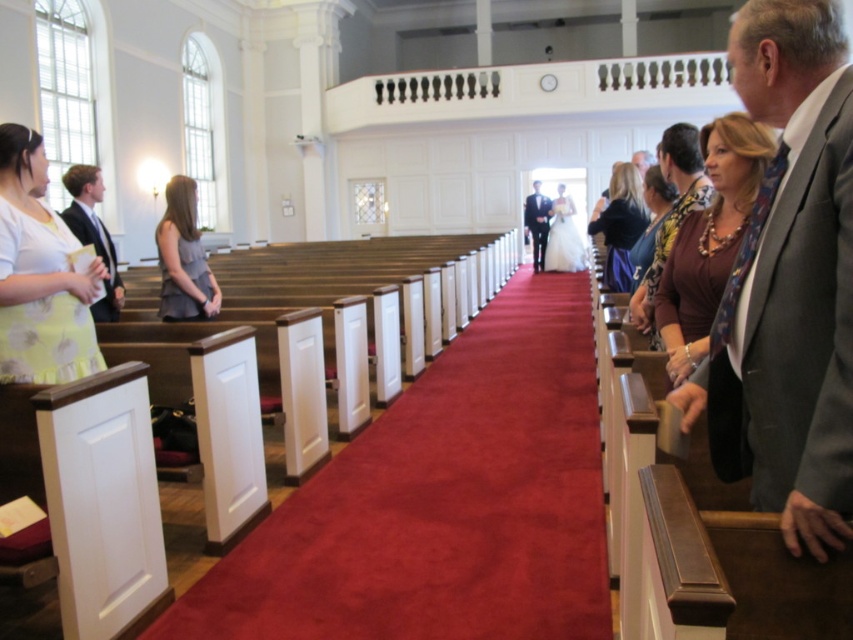
What do you see at coordinates (709, 240) in the screenshot? I see `brown fabric scarf at upper right` at bounding box center [709, 240].

Find the location of a particular element. This screenshot has width=853, height=640. brown fabric scarf at upper right is located at coordinates (709, 240).

Is point (688, 241) positioned before point (689, 140)?

Yes, it is.

At what (x,y) coordinates should I click in order to perform the action: click on brown fabric scarf at upper right. Please return your answer as a coordinate pair (x, y). This screenshot has width=853, height=640. Looking at the image, I should click on (709, 240).

Is yellow floral dress at left above brown fabric scarf at upper right?

Yes.

Who is higher up, yellow floral dress at left or brown fabric scarf at upper right?

Positioned higher is yellow floral dress at left.

Is point (9, 125) closer to viewer compared to point (694, 324)?

That is False.

Find the location of a particular element. The width and height of the screenshot is (853, 640). yellow floral dress at left is located at coordinates (39, 275).

Can you confirm if brown fabric dress at right is smaller than white satin dress at center?

Correct, brown fabric dress at right occupies less space than white satin dress at center.

What do you see at coordinates (671, 211) in the screenshot? The image size is (853, 640). I see `brown fabric dress at right` at bounding box center [671, 211].

The width and height of the screenshot is (853, 640). What do you see at coordinates (671, 211) in the screenshot?
I see `brown fabric dress at right` at bounding box center [671, 211].

This screenshot has width=853, height=640. In order to click on brown fabric dress at right in this screenshot , I will do click(x=671, y=211).